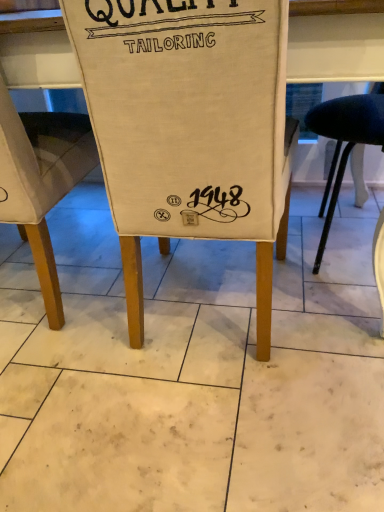
Find the location of a particular element. free area below canvas bag at center, positioned as the 1th chair in right-to-left order (from a real-world perspective) is located at coordinates (216, 307).